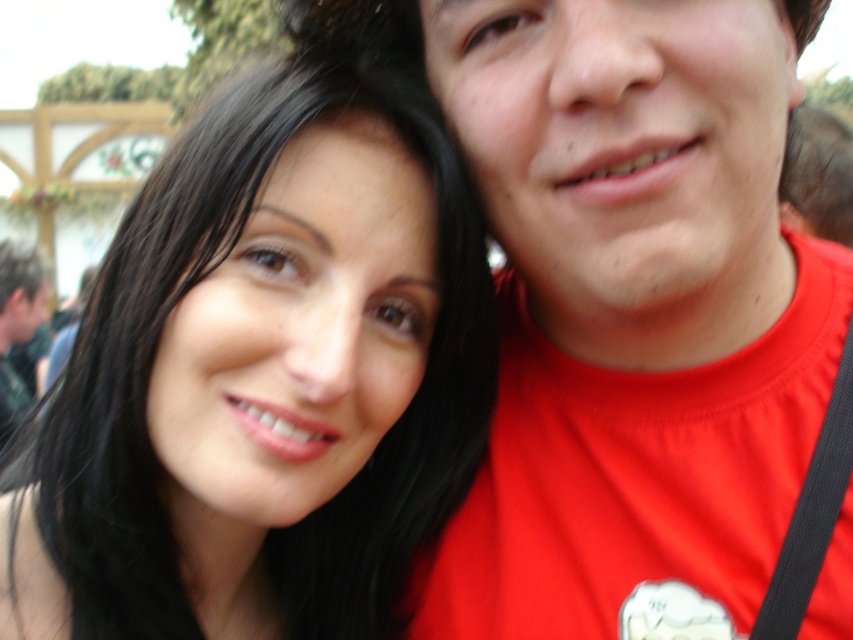
Which of these two, smooth black hair at upper left or matte red shirt at right, stands taller?

matte red shirt at right

Does smooth black hair at upper left come behind matte red shirt at right?

Yes, smooth black hair at upper left is behind matte red shirt at right.

You are a GUI agent. You are given a task and a screenshot of the screen. Output one action in this format:
    pyautogui.click(x=<x>, y=<y>)
    Task: Click on the smooth black hair at upper left
    The width and height of the screenshot is (853, 640).
    Given the screenshot: What is the action you would take?
    pyautogui.click(x=262, y=378)